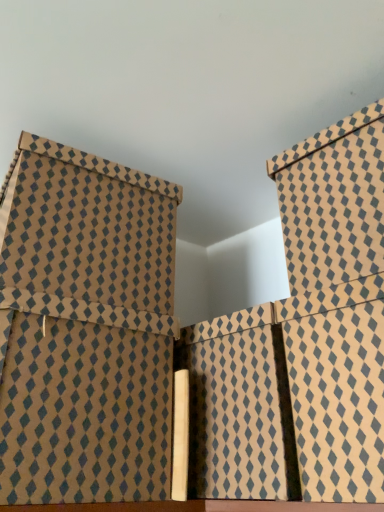
Identify the location of brown cardboard box at left. Image resolution: width=384 pixels, height=512 pixels. (85, 328).

The image size is (384, 512). What do you see at coordinates (85, 328) in the screenshot?
I see `brown cardboard box at left` at bounding box center [85, 328].

Identify the location of brown cardboard box at left. (85, 328).